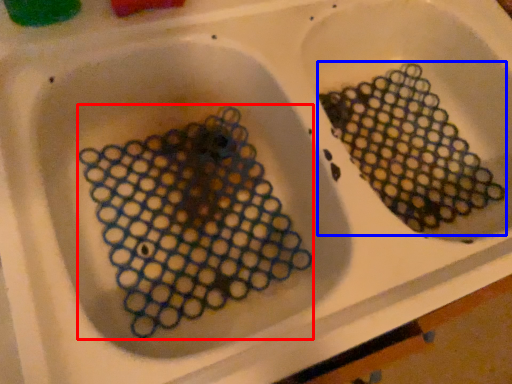
Question: Which object is further to the camera taking this photo, debris (highlighted by a red box) or debris (highlighted by a blue box)?

Choices:
 (A) debris
 (B) debris

Answer: (B)